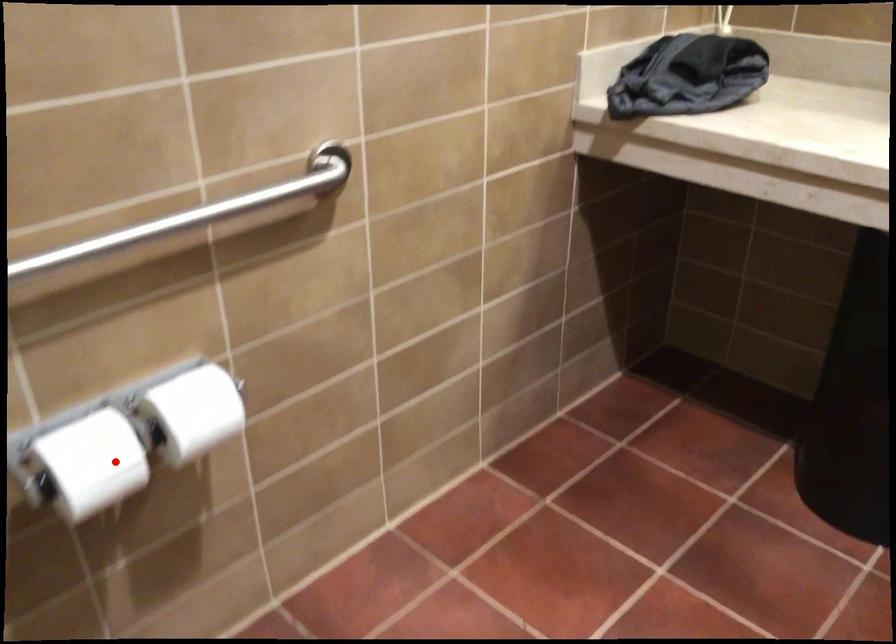
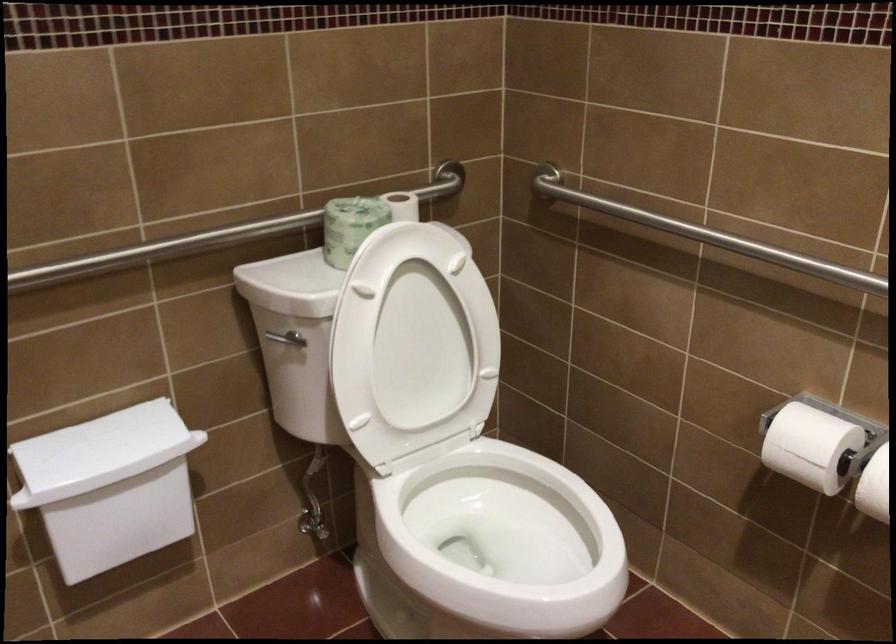
Question: I am providing you with two images of the same scene from different viewpoints. Image1 has a red point marked. In image2, the corresponding 3D location appears at what relative position? Reply with the corresponding letter.

Choices:
 (A) Closer
 (B) Farther

Answer: (B)